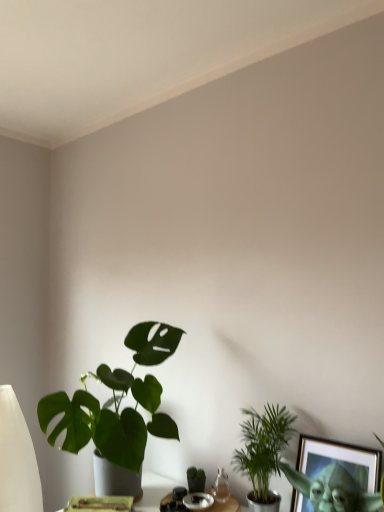
This screenshot has height=512, width=384. What do you see at coordinates (263, 448) in the screenshot? I see `green leafy plant at lower right, which appears as the 1th houseplant when viewed from the right` at bounding box center [263, 448].

What is the approximate width of green matte plant at lower left, which is the 1th houseplant from left to right?

21.92 inches.

The image size is (384, 512). Describe the element at coordinates (333, 489) in the screenshot. I see `gold-framed picture at lower right` at that location.

The width and height of the screenshot is (384, 512). Describe the element at coordinates (196, 479) in the screenshot. I see `green matte houseplant at center, the 2th houseplant from the right` at that location.

What are the coordinates of `green leafy plant at lower right, which appears as the 1th houseplant when viewed from the right` in the screenshot? It's located at (263, 448).

Which of these two, green matte plant at lower left, the 3th houseplant when ordered from right to left, or gold-framed picture at lower right, is thinner?

Thinner between the two is gold-framed picture at lower right.

Does green matte plant at lower left, the 3th houseplant when ordered from right to left, come in front of gold-framed picture at lower right?

No, the depth of green matte plant at lower left, the 3th houseplant when ordered from right to left, is greater than that of gold-framed picture at lower right.

Considering the sizes of green matte plant at lower left, which is the 1th houseplant from left to right, and gold-framed picture at lower right in the image, is green matte plant at lower left, which is the 1th houseplant from left to right, taller or shorter than gold-framed picture at lower right?

green matte plant at lower left, which is the 1th houseplant from left to right, is taller than gold-framed picture at lower right.

Can you confirm if gold-framed picture at lower right is wider than green matte plant at lower left, the 3th houseplant when ordered from right to left?

No, gold-framed picture at lower right is not wider than green matte plant at lower left, the 3th houseplant when ordered from right to left.

From a real-world perspective, is gold-framed picture at lower right positioned under green matte plant at lower left, which is the 1th houseplant from left to right, based on gravity?

Correct, in the physical world, gold-framed picture at lower right is lower than green matte plant at lower left, which is the 1th houseplant from left to right.

From the image's perspective, does gold-framed picture at lower right appear higher than green matte plant at lower left, which is the 1th houseplant from left to right?

No, from the image's perspective, gold-framed picture at lower right is not above green matte plant at lower left, which is the 1th houseplant from left to right.

Which of these two, gold-framed picture at lower right or green matte plant at lower left, which is the 1th houseplant from left to right, is bigger?

green matte plant at lower left, which is the 1th houseplant from left to right.

From the image's perspective, is green leafy plant at lower right, which appears as the 1th houseplant when viewed from the right, under gold-framed picture at lower right?

Incorrect, from the image's perspective, green leafy plant at lower right, which appears as the 1th houseplant when viewed from the right, is higher than gold-framed picture at lower right.

From a real-world perspective, is green leafy plant at lower right, which appears as the 1th houseplant when viewed from the right, physically located above or below gold-framed picture at lower right?

green leafy plant at lower right, which appears as the 1th houseplant when viewed from the right, is above gold-framed picture at lower right.

You are a GUI agent. You are given a task and a screenshot of the screen. Output one action in this format:
    pyautogui.click(x=<x>, y=<y>)
    Task: Click on the 1st houseplant positioned above the gold-framed picture at lower right (from the image's perspective)
    Image resolution: width=384 pixels, height=512 pixels.
    Given the screenshot: What is the action you would take?
    pyautogui.click(x=263, y=448)

Does green matte houseplant at center, which ranks as the second houseplant in left-to-right order, have a greater height compared to gold-framed picture at lower right?

No.

Is green matte houseplant at center, which ranks as the second houseplant in left-to-right order, completely or partially outside of gold-framed picture at lower right?

Yes, green matte houseplant at center, which ranks as the second houseplant in left-to-right order, is not within gold-framed picture at lower right.

Is green matte houseplant at center, which ranks as the second houseplant in left-to-right order, at the left side of gold-framed picture at lower right?

Yes, green matte houseplant at center, which ranks as the second houseplant in left-to-right order, is to the left of gold-framed picture at lower right.

Considering the sizes of objects green matte houseplant at center, which ranks as the second houseplant in left-to-right order, and gold-framed picture at lower right in the image provided, who is bigger, green matte houseplant at center, which ranks as the second houseplant in left-to-right order, or gold-framed picture at lower right?

With larger size is gold-framed picture at lower right.

What's the angular difference between green matte plant at lower left, which is the 1th houseplant from left to right, and green leafy plant at lower right, the 3th houseplant when ordered from left to right,'s facing directions?

green matte plant at lower left, which is the 1th houseplant from left to right, and green leafy plant at lower right, the 3th houseplant when ordered from left to right, are facing 0.000191 degrees away from each other.

From the image's perspective, which houseplant is the 1st one below the green matte plant at lower left, the 3th houseplant when ordered from right to left? Please provide its 2D coordinates.

[(263, 448)]

Based on the photo, is green matte plant at lower left, which is the 1th houseplant from left to right, situated inside green leafy plant at lower right, the 3th houseplant when ordered from left to right, or outside?

green matte plant at lower left, which is the 1th houseplant from left to right, cannot be found inside green leafy plant at lower right, the 3th houseplant when ordered from left to right.

Is green matte plant at lower left, which is the 1th houseplant from left to right, smaller than green leafy plant at lower right, which appears as the 1th houseplant when viewed from the right?

No.

From the image's perspective, is green matte plant at lower left, which is the 1th houseplant from left to right, under green matte houseplant at center, the 2th houseplant from the right?

No.

Does point (158, 392) lie in front of point (193, 484)?

No, it is behind (193, 484).

Could you measure the distance between green matte plant at lower left, which is the 1th houseplant from left to right, and green matte houseplant at center, the 2th houseplant from the right?

The distance of green matte plant at lower left, which is the 1th houseplant from left to right, from green matte houseplant at center, the 2th houseplant from the right, is 40.52 centimeters.

Could you tell me if green matte plant at lower left, the 3th houseplant when ordered from right to left, is facing green matte houseplant at center, which ranks as the second houseplant in left-to-right order?

No, green matte plant at lower left, the 3th houseplant when ordered from right to left, is not aimed at green matte houseplant at center, which ranks as the second houseplant in left-to-right order.

How many degrees apart are the facing directions of gold-framed picture at lower right and green matte houseplant at center, which ranks as the second houseplant in left-to-right order?

The angle between the facing direction of gold-framed picture at lower right and the facing direction of green matte houseplant at center, which ranks as the second houseplant in left-to-right order, is 25.1 degrees.

Is gold-framed picture at lower right smaller than green matte houseplant at center, the 2th houseplant from the right?

Actually, gold-framed picture at lower right might be larger than green matte houseplant at center, the 2th houseplant from the right.

Which object is further away from the camera, gold-framed picture at lower right or green matte houseplant at center, which ranks as the second houseplant in left-to-right order?

green matte houseplant at center, which ranks as the second houseplant in left-to-right order, is further away from the camera.

Starting from the gold-framed picture at lower right, which houseplant is the 3rd one behind? Please provide its 2D coordinates.

[(196, 479)]

Image resolution: width=384 pixels, height=512 pixels. I want to click on houseplant that is the 2nd one when counting upward from the gold-framed picture at lower right (from the image's perspective), so [x=117, y=404].

Where is `picture frame in front of the green matte plant at lower left, the 3th houseplant when ordered from right to left`? picture frame in front of the green matte plant at lower left, the 3th houseplant when ordered from right to left is located at coordinates (333, 489).

In the scene shown: Based on their spatial positions, is green leafy plant at lower right, the 3th houseplant when ordered from left to right, or green matte plant at lower left, which is the 1th houseplant from left to right, further from green matte houseplant at center, which ranks as the second houseplant in left-to-right order?

green matte plant at lower left, which is the 1th houseplant from left to right, is further to green matte houseplant at center, which ranks as the second houseplant in left-to-right order.

From the image, which object appears to be farther from green matte houseplant at center, which ranks as the second houseplant in left-to-right order, gold-framed picture at lower right or green matte plant at lower left, the 3th houseplant when ordered from right to left?

gold-framed picture at lower right lies further to green matte houseplant at center, which ranks as the second houseplant in left-to-right order, than the other object.

From the image, which object appears to be nearer to green matte plant at lower left, which is the 1th houseplant from left to right, gold-framed picture at lower right or green leafy plant at lower right, which appears as the 1th houseplant when viewed from the right?

Based on the image, green leafy plant at lower right, which appears as the 1th houseplant when viewed from the right, appears to be nearer to green matte plant at lower left, which is the 1th houseplant from left to right.

Looking at the image, which one is located further to gold-framed picture at lower right, green leafy plant at lower right, the 3th houseplant when ordered from left to right, or green matte plant at lower left, which is the 1th houseplant from left to right?

green matte plant at lower left, which is the 1th houseplant from left to right, is further to gold-framed picture at lower right.

Looking at the image, which one is located closer to green leafy plant at lower right, the 3th houseplant when ordered from left to right, green matte houseplant at center, the 2th houseplant from the right, or green matte plant at lower left, which is the 1th houseplant from left to right?

Among the two, green matte houseplant at center, the 2th houseplant from the right, is located nearer to green leafy plant at lower right, the 3th houseplant when ordered from left to right.

Considering their positions, is green leafy plant at lower right, the 3th houseplant when ordered from left to right, positioned further to green matte houseplant at center, the 2th houseplant from the right, than gold-framed picture at lower right?

gold-framed picture at lower right is positioned further to the anchor green matte houseplant at center, the 2th houseplant from the right.

Which object lies further to the anchor point gold-framed picture at lower right, green matte plant at lower left, which is the 1th houseplant from left to right, or green leafy plant at lower right, the 3th houseplant when ordered from left to right?

green matte plant at lower left, which is the 1th houseplant from left to right, is further to gold-framed picture at lower right.

Which object lies further to the anchor point gold-framed picture at lower right, green matte plant at lower left, which is the 1th houseplant from left to right, or green matte houseplant at center, the 2th houseplant from the right?

green matte plant at lower left, which is the 1th houseplant from left to right.

Locate an element on the screen. The width and height of the screenshot is (384, 512). houseplant between green matte plant at lower left, which is the 1th houseplant from left to right, and green leafy plant at lower right, which appears as the 1th houseplant when viewed from the right is located at coordinates (196, 479).